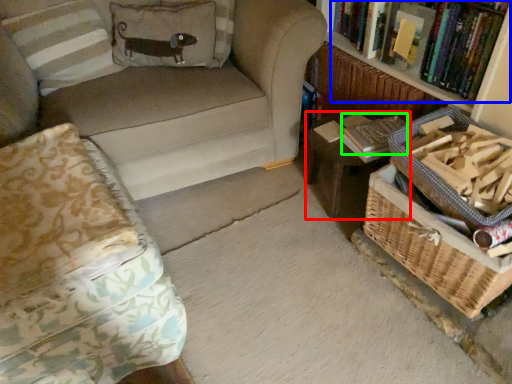
Question: Which object is the closest to the table (highlighted by a red box)? Choose among these: book (highlighted by a blue box) or paperback book (highlighted by a green box).

Choices:
 (A) book
 (B) paperback book

Answer: (B)